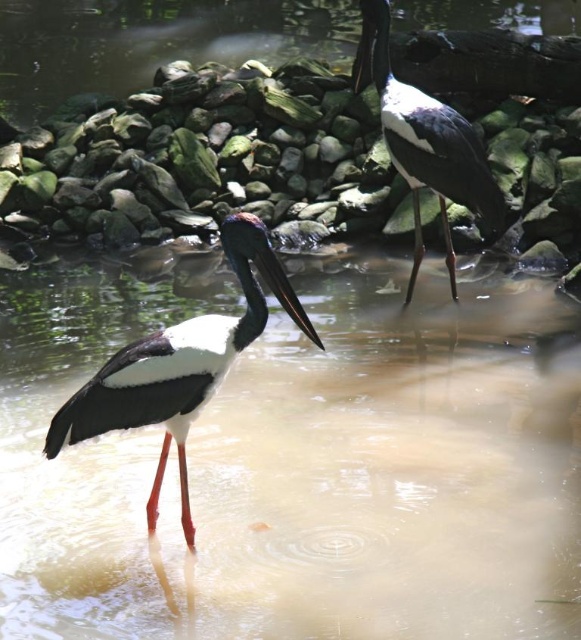
Question: Which point is closer to the camera?

Choices:
 (A) (74, 429)
 (B) (479, 193)

Answer: (A)

Question: Is translucent muddy water at center above black glossy stork at center?

Choices:
 (A) no
 (B) yes

Answer: (A)

Question: Among these objects, which one is nearest to the camera?

Choices:
 (A) black glossy stork at upper right
 (B) translucent muddy water at center
 (C) black glossy stork at center

Answer: (C)

Question: From the image, what is the correct spatial relationship of translucent muddy water at center in relation to black glossy stork at center?

Choices:
 (A) above
 (B) below

Answer: (B)

Question: Observing the image, what is the correct spatial positioning of translucent muddy water at center in reference to black glossy stork at center?

Choices:
 (A) below
 (B) above

Answer: (A)

Question: Which point appears closest to the camera in this image?

Choices:
 (A) (496, 454)
 (B) (376, 83)

Answer: (A)